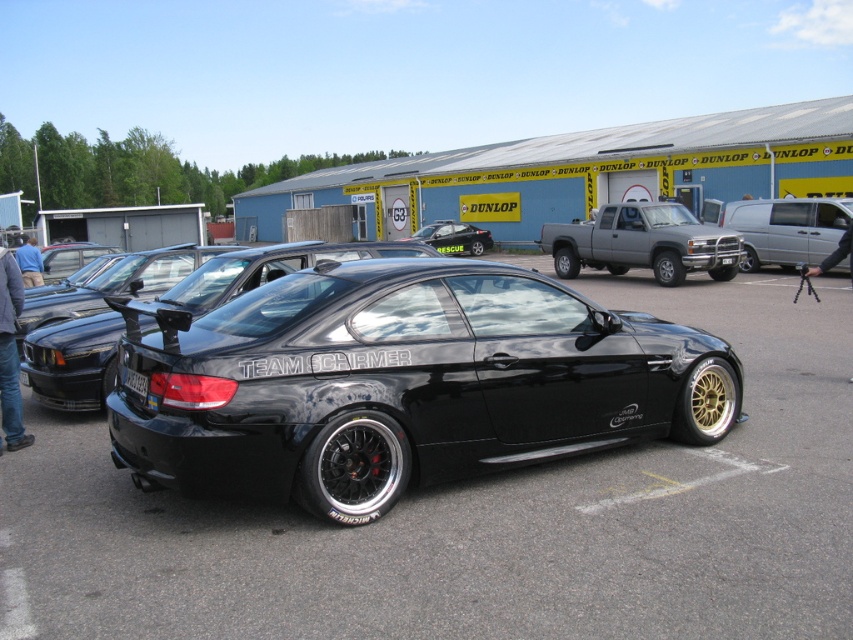
How far apart are black matte/satin car at center and matte black car at center?

They are 91.86 feet apart.

Between black matte/satin car at center and matte black car at center, which one is positioned higher?

matte black car at center is above.

In order to click on black matte/satin car at center in this screenshot , I will do `click(403, 381)`.

Is point (252, 428) behind point (456, 244)?

No, it is not.

Where is `black matte/satin car at center`? This screenshot has width=853, height=640. black matte/satin car at center is located at coordinates (403, 381).

You are a GUI agent. You are given a task and a screenshot of the screen. Output one action in this format:
    pyautogui.click(x=<x>, y=<y>)
    Task: Click on the black matte/satin car at center
    
    Given the screenshot: What is the action you would take?
    pyautogui.click(x=403, y=381)

Is black matte car at center in front of matte black car at center?

Yes, black matte car at center is in front of matte black car at center.

The width and height of the screenshot is (853, 640). What do you see at coordinates (73, 362) in the screenshot? I see `black matte car at center` at bounding box center [73, 362].

Find the location of a particular element. black matte car at center is located at coordinates tap(73, 362).